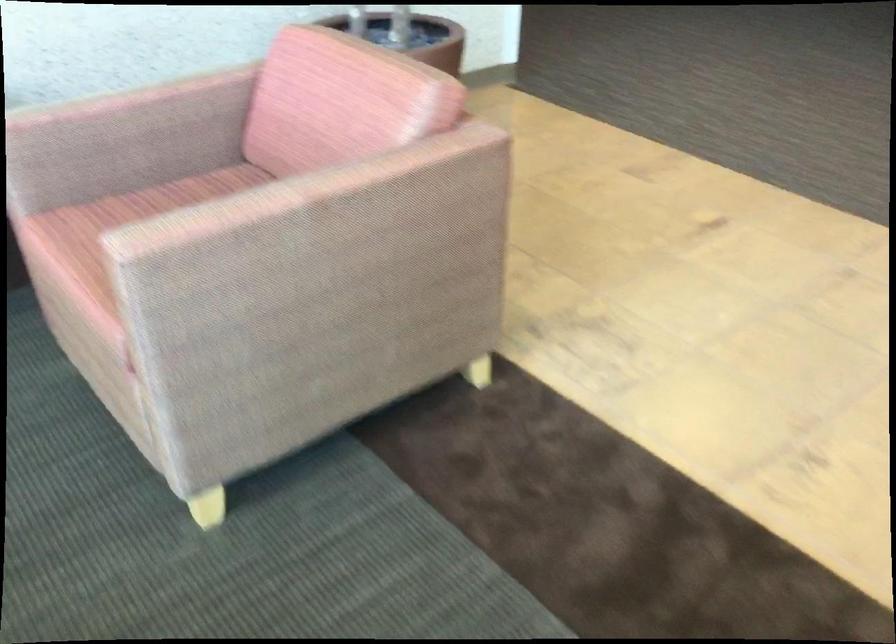
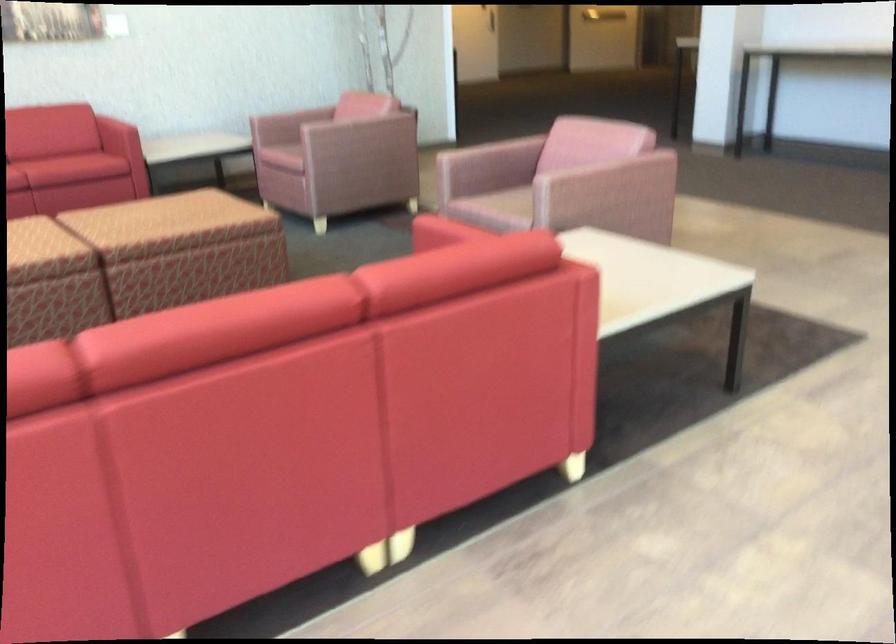
Question: The images are taken continuously from a first-person perspective. In which direction are you moving?

Choices:
 (A) Left
 (B) Right
 (C) Forward
 (D) Backward

Answer: (D)